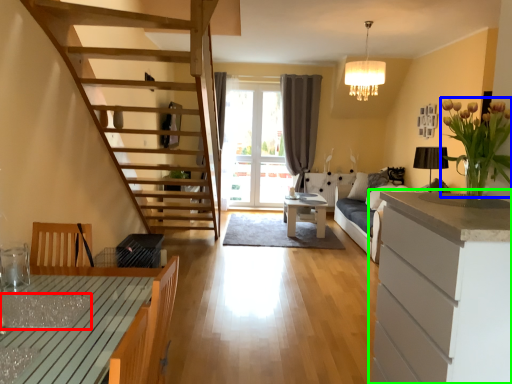
Question: Which object is the closest to the glass table (highlighted by a red box)? Choose among these: flower (highlighted by a blue box) or cabinetry (highlighted by a green box).

Choices:
 (A) flower
 (B) cabinetry

Answer: (B)